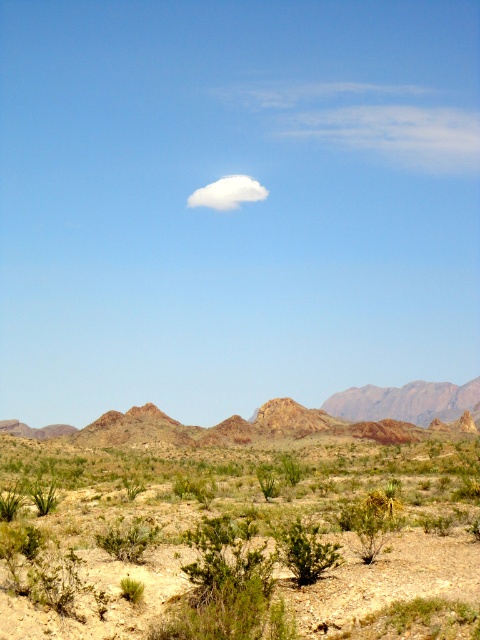
Question: Which is nearer to the white fluffy cloud at upper center?

Choices:
 (A) rugged rock mountain at center
 (B) rustic rock formation at center
 (C) green shrubs at center

Answer: (A)

Question: Which object appears closest to the camera in this image?

Choices:
 (A) white fluffy cloud at upper center
 (B) green shrubs at center
 (C) rustic rock formation at center

Answer: (B)

Question: Does green shrubs at center come in front of rustic rock formation at center?

Choices:
 (A) no
 (B) yes

Answer: (B)

Question: Is green shrubs at center bigger than rustic rock formation at center?

Choices:
 (A) no
 (B) yes

Answer: (A)

Question: Can you confirm if green shrubs at center is positioned to the left of rustic rock formation at center?

Choices:
 (A) yes
 (B) no

Answer: (B)

Question: Which object is closer to the camera taking this photo?

Choices:
 (A) rugged rock mountain at center
 (B) rustic rock formation at center
 (C) green shrubs at center
 (D) white fluffy cloud at upper center

Answer: (C)